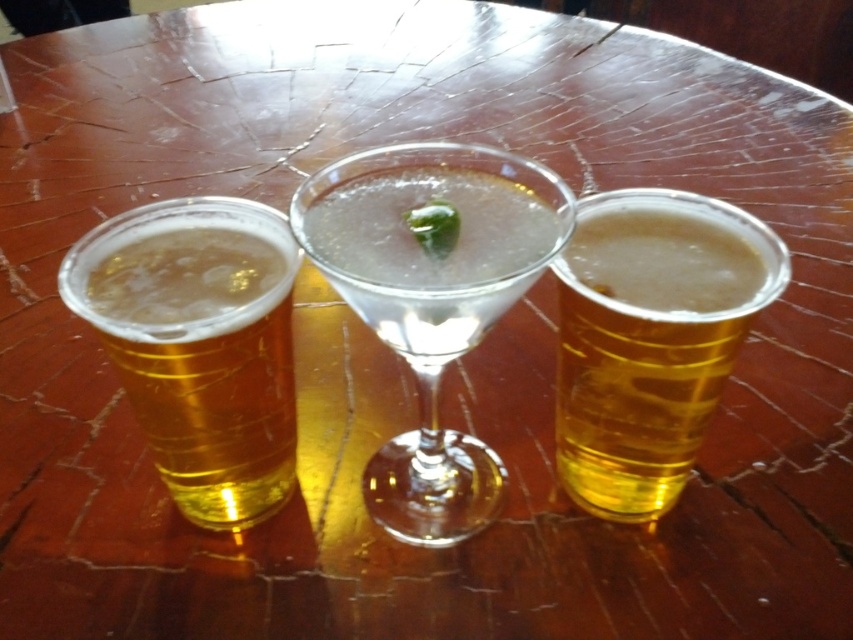
You are at a picnic and need to grab a cup from the table. The cups are arranged with the translucent plastic cup at left and the translucent plastic cup at right. Which cup should you take if you want the one closer to the edge of the table?

The translucent plastic cup at left is to the left of the translucent plastic cup at right, so the one closer to the edge would depend on the table orientation. However, based on the description, the left cup is positioned further left, making it closer to the table edge if you are facing the image. Take the translucent plastic cup at left.

You are at a party and want to pour a drink into the clear glass martini at center. However, you only have a small pitcher that can hold up to 200ml. Do you think the pitcher will fit into the translucent plastic cup at left without spilling?

The clear glass martini at center might be wider than the translucent plastic cup at left, so the pitcher might not fit into the translucent plastic cup at left if it is wider.